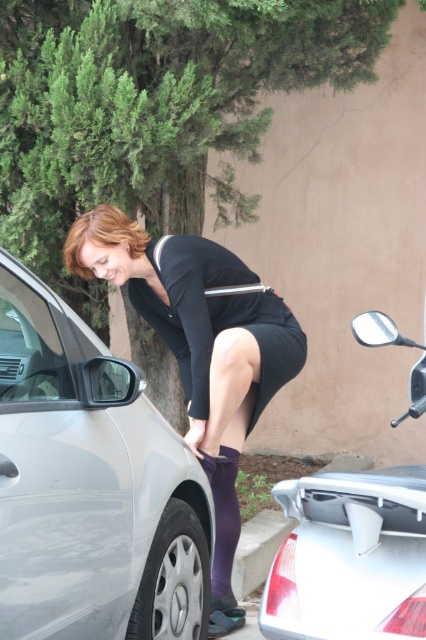
Is satin silver car at left to the left of silver metallic car at lower right from the viewer's perspective?

Indeed, satin silver car at left is positioned on the left side of silver metallic car at lower right.

Is point (23, 586) farther from viewer compared to point (353, 544)?

No, it is in front of (353, 544).

You are a GUI agent. You are given a task and a screenshot of the screen. Output one action in this format:
    pyautogui.click(x=<x>, y=<y>)
    Task: Click on the satin silver car at left
    The width and height of the screenshot is (426, 640).
    Given the screenshot: What is the action you would take?
    pyautogui.click(x=91, y=486)

Does matte black dress at center appear on the left side of silver metallic car at lower right?

Yes, matte black dress at center is to the left of silver metallic car at lower right.

Is matte black dress at center bigger than silver metallic car at lower right?

Yes, matte black dress at center is bigger than silver metallic car at lower right.

Who is more distant from viewer, (281, 333) or (422, 548)?

Positioned behind is point (281, 333).

The image size is (426, 640). What are the coordinates of `matte black dress at center` in the screenshot? It's located at (201, 353).

Is satin silver car at left behind matte black dress at center?

No, it is not.

Is point (51, 616) positioned after point (77, 244)?

No.

Between point (120, 468) and point (209, 300), which one is positioned in front?

Positioned in front is point (120, 468).

I want to click on satin silver car at left, so click(x=91, y=486).